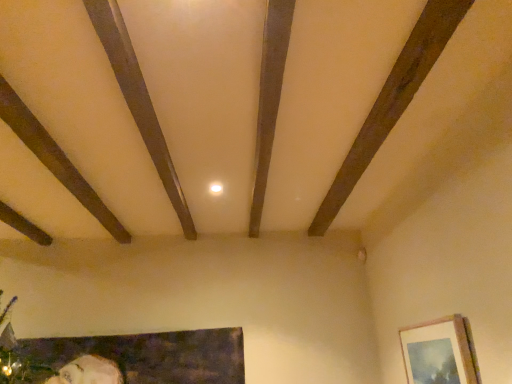
Measure the distance between point (449, 346) and camera.

Point (449, 346) and camera are 1.80 meters apart from each other.

This screenshot has height=384, width=512. In order to click on matte wooden picture frame at lower right in this screenshot , I will do `click(438, 353)`.

The image size is (512, 384). Describe the element at coordinates (438, 353) in the screenshot. I see `matte wooden picture frame at lower right` at that location.

Where is `matte wooden picture frame at lower right`? Image resolution: width=512 pixels, height=384 pixels. matte wooden picture frame at lower right is located at coordinates (438, 353).